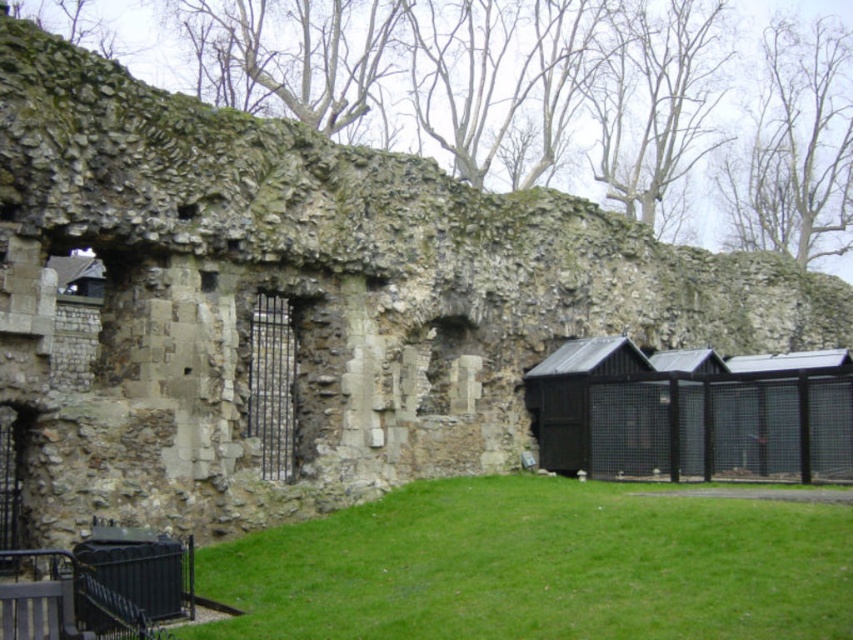
Which is more to the right, green grass at lower center or black metal hut at right?

From the viewer's perspective, black metal hut at right appears more on the right side.

Does green grass at lower center have a smaller size compared to black metal hut at right?

Indeed, green grass at lower center has a smaller size compared to black metal hut at right.

The height and width of the screenshot is (640, 853). What are the coordinates of `green grass at lower center` in the screenshot? It's located at (538, 566).

Locate an element on the screen. This screenshot has height=640, width=853. green grass at lower center is located at coordinates (538, 566).